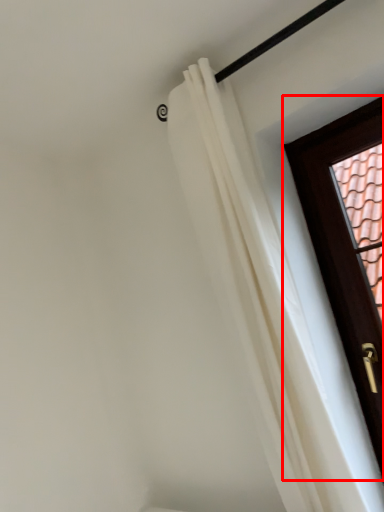
Question: Observing the image, what is the correct spatial positioning of door (annotated by the red box) in reference to curtain?

Choices:
 (A) left
 (B) right

Answer: (B)